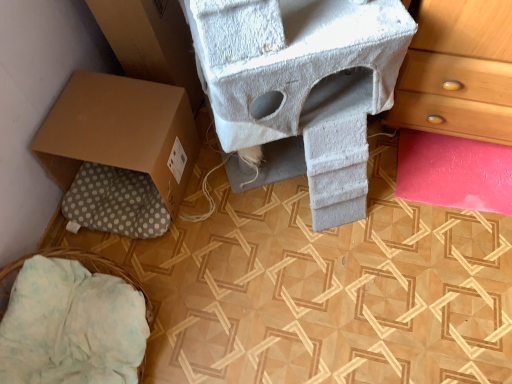
The height and width of the screenshot is (384, 512). I want to click on free location to the right of white fabric basket at lower left, so click(228, 305).